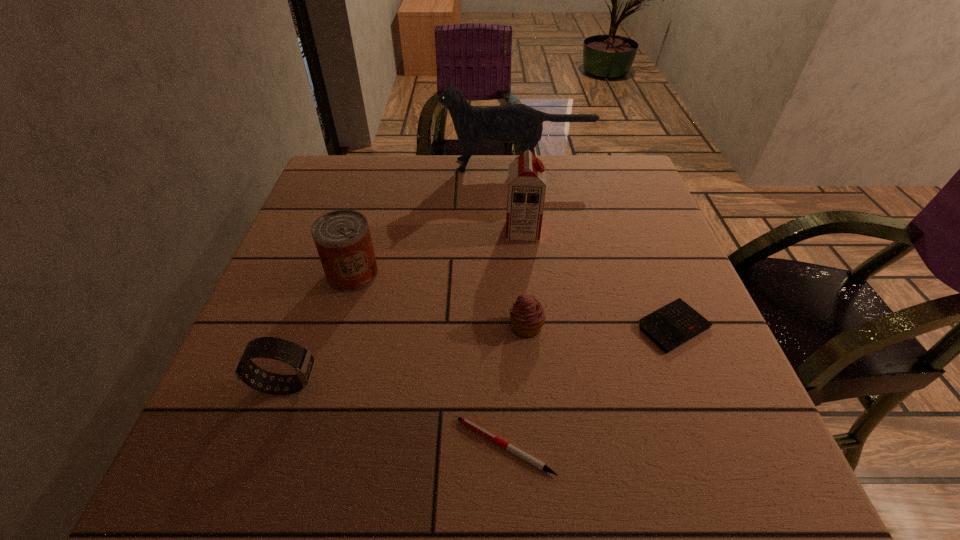
The image size is (960, 540). In order to click on vacant space situated 0.050m on the front-facing side of the cat in this screenshot , I will do `click(424, 166)`.

Image resolution: width=960 pixels, height=540 pixels. Find the location of `vacant space situated 0.280m on the front-facing side of the cat`. vacant space situated 0.280m on the front-facing side of the cat is located at coordinates (344, 166).

Locate an element on the screen. The height and width of the screenshot is (540, 960). free space located 0.240m on the front-facing side of the cat is located at coordinates (358, 166).

Where is `free spot located 0.070m on the left of the sixth nearest object`? This screenshot has height=540, width=960. free spot located 0.070m on the left of the sixth nearest object is located at coordinates (475, 232).

Where is `vacant space located on the right of the third tallest object`? This screenshot has height=540, width=960. vacant space located on the right of the third tallest object is located at coordinates (443, 274).

Locate an element on the screen. vacant space located 0.050m on the face of the watch is located at coordinates (348, 385).

This screenshot has width=960, height=540. In order to click on vacant region located on the back of the third shortest object in this screenshot , I will do `click(521, 272)`.

You are a GUI agent. You are given a task and a screenshot of the screen. Output one action in this format:
    pyautogui.click(x=<x>, y=<y>)
    Task: Click on the free location located 0.060m on the left of the second shortest object
    
    Given the screenshot: What is the action you would take?
    pyautogui.click(x=607, y=327)

What are the coordinates of `vacant space situated 0.250m on the clicker of the nearest object` in the screenshot? It's located at (295, 447).

The width and height of the screenshot is (960, 540). Find the location of `vacant area situated on the clicker of the nearest object`. vacant area situated on the clicker of the nearest object is located at coordinates (321, 447).